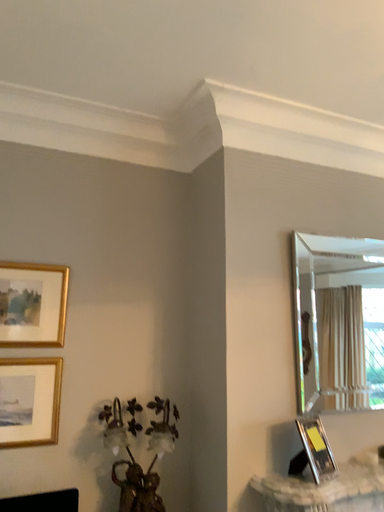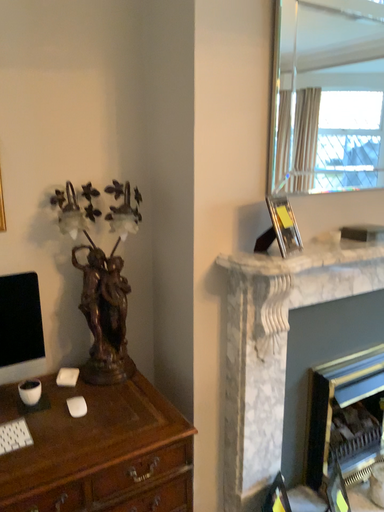
Question: How did the camera likely rotate when shooting the video?

Choices:
 (A) rotated left
 (B) rotated right

Answer: (B)